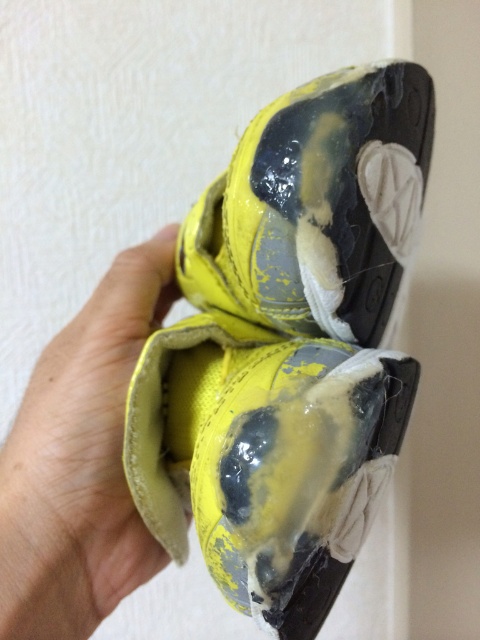
You are holding two items in your hand, a yellow matte shoe at center and a yellow leather hand at center. Which one is wider?

The yellow matte shoe at center is wider than the yellow leather hand at center because its width surpasses the hand.

From the picture: You are holding two points on the worn yellow sports shoes. The first point is at coordinate point (342, 468) and the second is at point (103, 483). Which point is nearer to your hand?

Point (342, 468) is closer to the viewer than point (103, 483), so the first point is nearer to your hand.

You are holding two yellow sports shoes in your hands. You want to place them on a shelf in front of you. The shelf has a small mark at point (288,346). Where should you place the yellow matte shoe at center so that it aligns with the mark?

You should place the yellow matte shoe at center exactly at the point (288,346) on the shelf to align with the mark.